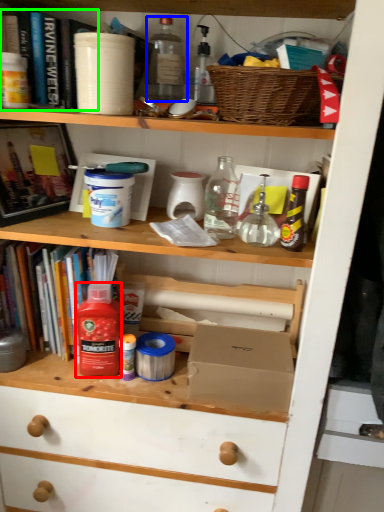
Question: Which object is positioned closest to bottle (highlighted by a red box)? Select from bottle (highlighted by a blue box) and book (highlighted by a green box).

Choices:
 (A) bottle
 (B) book

Answer: (B)